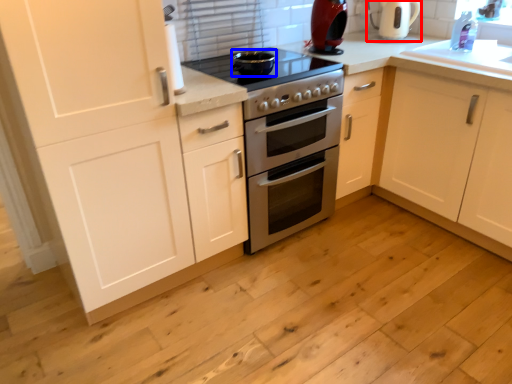
Question: Which object is further to the camera taking this photo, coffeepot (highlighted by a red box) or appliance (highlighted by a blue box)?

Choices:
 (A) coffeepot
 (B) appliance

Answer: (A)